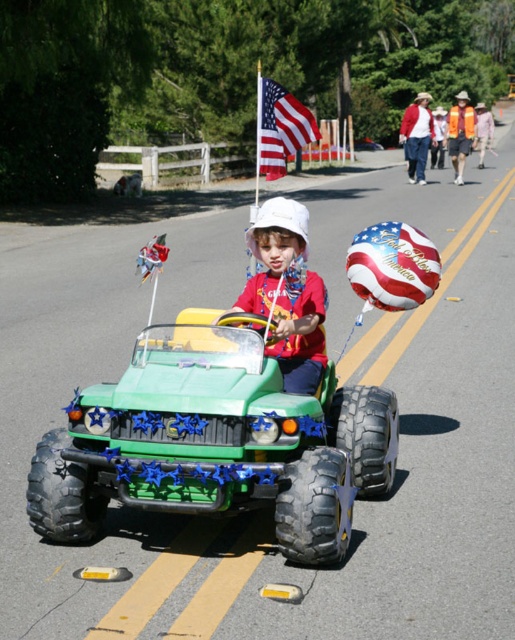
Question: Is american flag at center bigger than orange safety vest at center?

Choices:
 (A) no
 (B) yes

Answer: (A)

Question: Is american flag at center smaller than orange safety vest at center?

Choices:
 (A) no
 (B) yes

Answer: (B)

Question: Does white matte hat at center come behind american flag at center?

Choices:
 (A) yes
 (B) no

Answer: (B)

Question: Which point is closer to the camera?

Choices:
 (A) orange safety vest at center
 (B) american flag at center

Answer: (B)

Question: Which object is farther from the camera taking this photo?

Choices:
 (A) american flag at center
 (B) green rubber monster truck at center
 (C) white matte hat at center

Answer: (A)

Question: Which of the following is the farthest from the observer?

Choices:
 (A) (89, 417)
 (B) (265, 88)

Answer: (B)